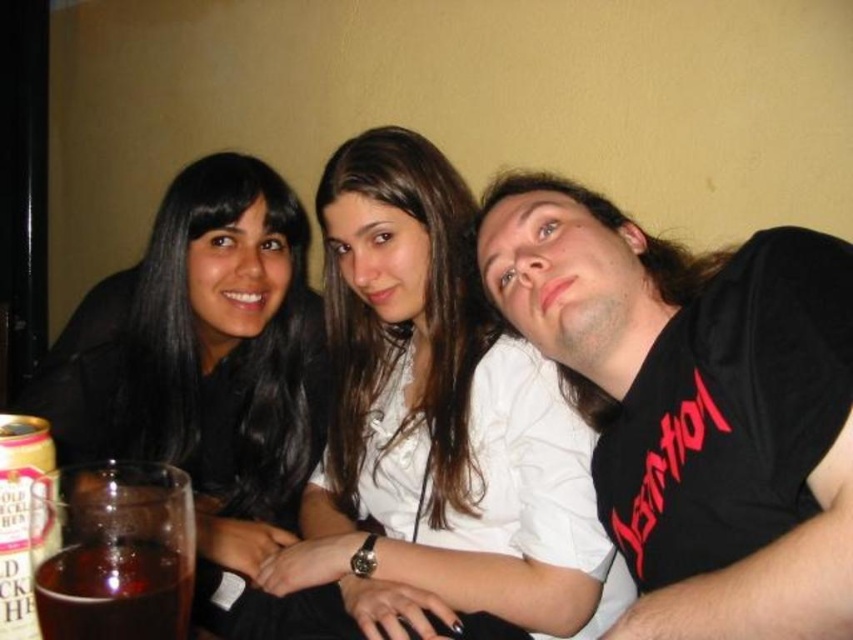
Question: Among these points, which one is nearest to the camera?

Choices:
 (A) (624, 365)
 (B) (373, 273)
 (C) (86, 456)

Answer: (A)

Question: Which object is the farthest from the smooth white blouse at center?

Choices:
 (A) black matte t-shirt at upper right
 (B) translucent glass at lower left

Answer: (B)

Question: Does smooth white blouse at center appear under translucent glass at lower left?

Choices:
 (A) no
 (B) yes

Answer: (A)

Question: Can you confirm if black matte t-shirt at upper right is positioned above black matte hair at upper left?

Choices:
 (A) no
 (B) yes

Answer: (A)

Question: Which point is farther to the camera?

Choices:
 (A) (534, 502)
 (B) (114, 634)
 (C) (709, 424)
 (D) (213, 204)

Answer: (D)

Question: Considering the relative positions of smooth white blouse at center and black matte hair at upper left in the image provided, where is smooth white blouse at center located with respect to black matte hair at upper left?

Choices:
 (A) left
 (B) right

Answer: (B)